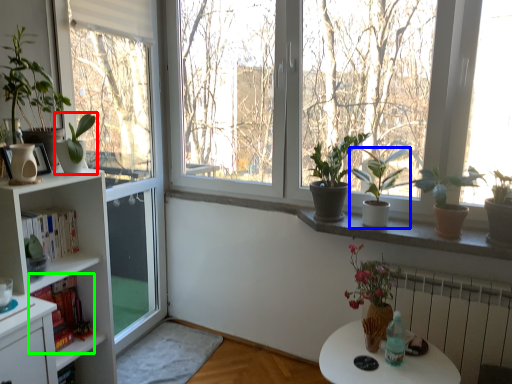
Question: Which object is the closest to the houseplant (highlighted by a red box)? Choose among these: houseplant (highlighted by a blue box) or book (highlighted by a green box).

Choices:
 (A) houseplant
 (B) book

Answer: (B)